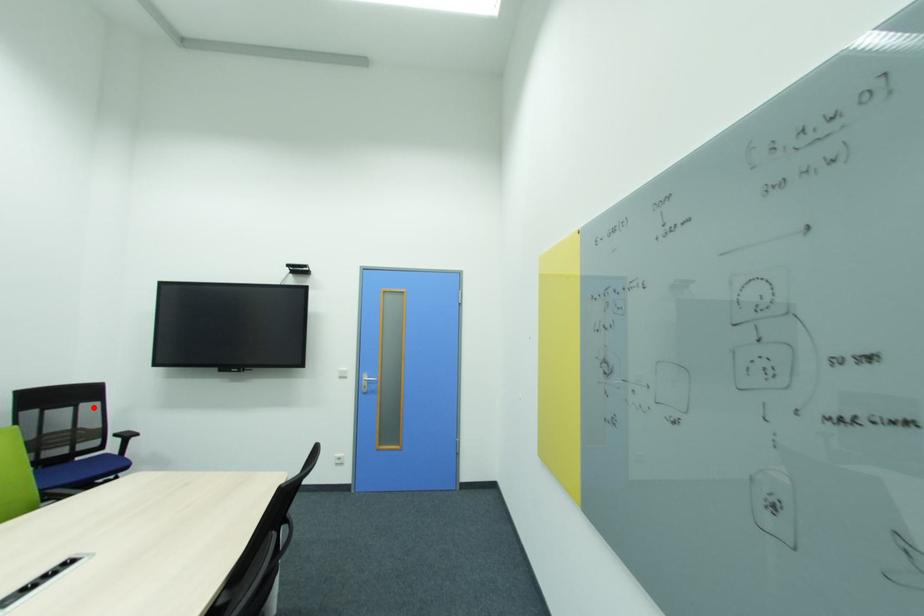
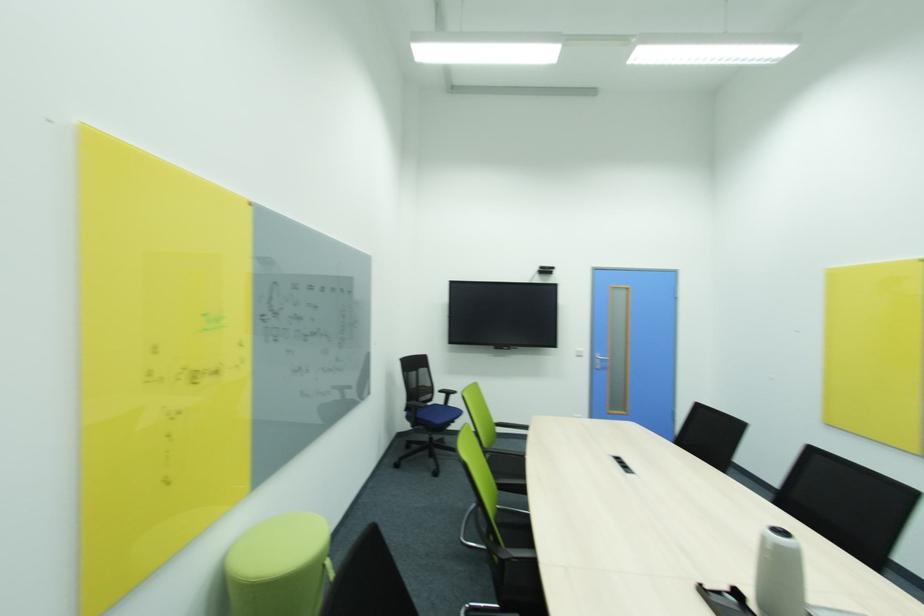
Find the pixel in the second image that matches the highlighted location in the first image.

(428, 371)